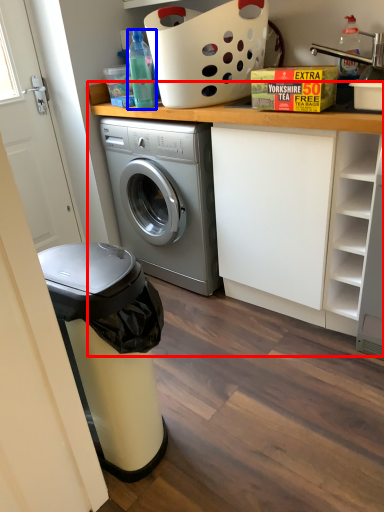
Question: Which of the following is the farthest to the observer, counter (highlighted by a red box) or bottle (highlighted by a blue box)?

Choices:
 (A) counter
 (B) bottle

Answer: (B)